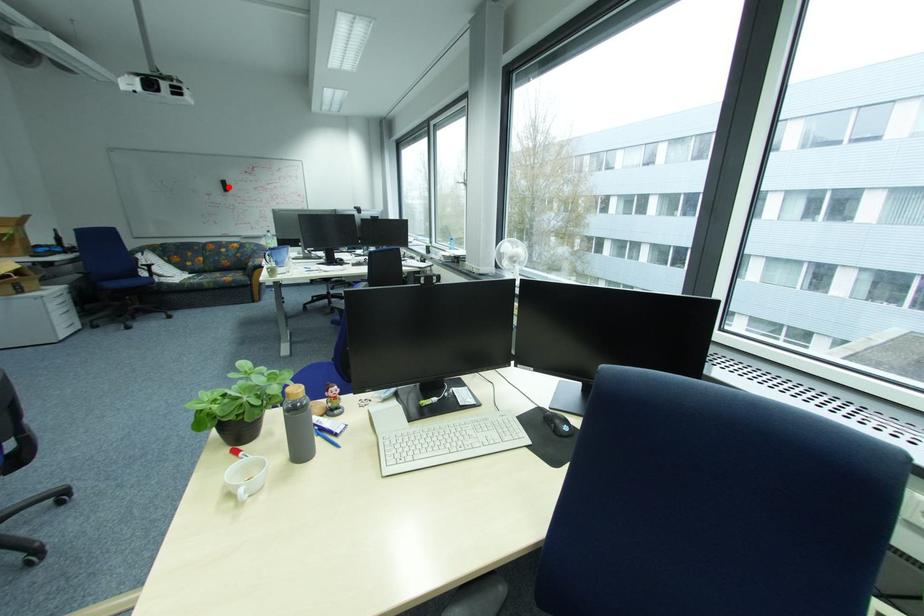
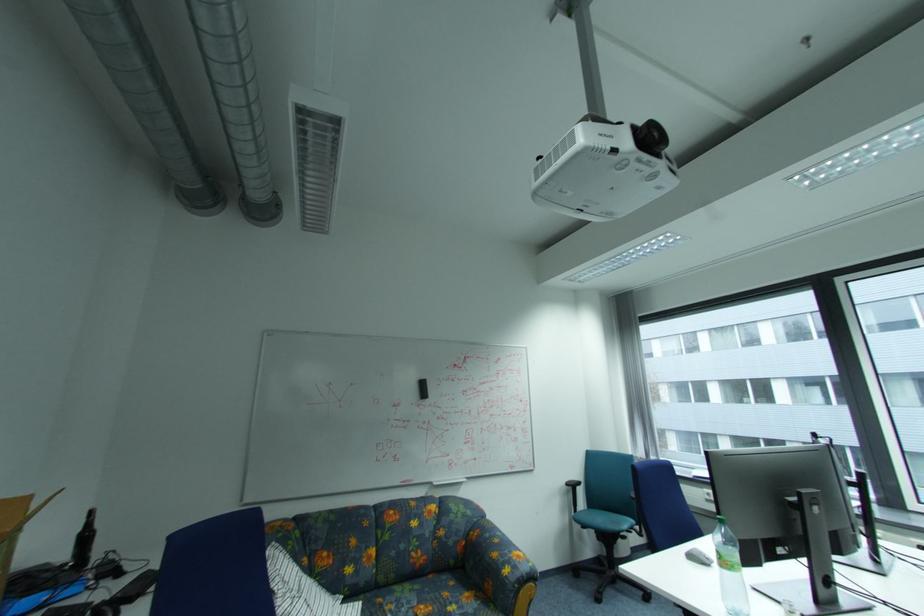
Question: I am providing you with two images of the same scene from different viewpoints. In image1, a red point is highlighted. Considering the same 3D point in image2, which of the following is correct?

Choices:
 (A) It is closer
 (B) It is farther

Answer: (B)